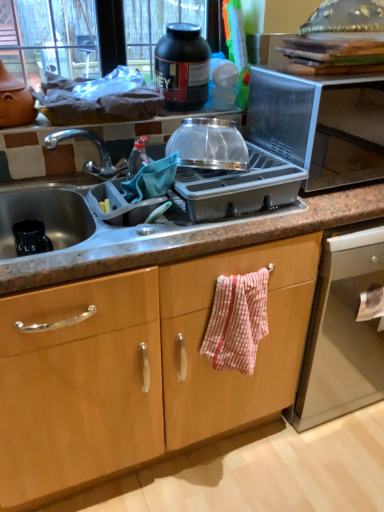
Locate an element on the screen. blank space situated above red and white checkered fabric at center (from a real-world perspective) is located at coordinates (239, 271).